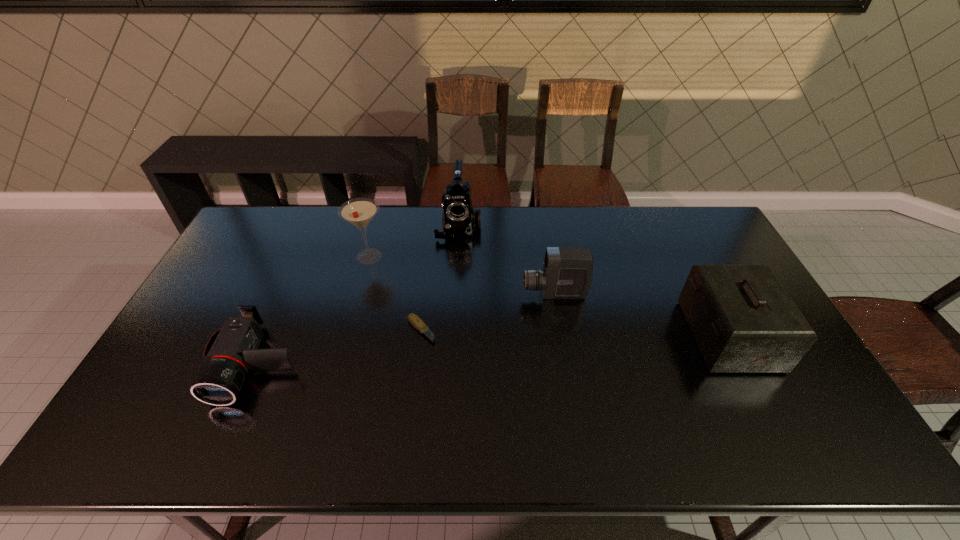
This screenshot has height=540, width=960. Find the location of `free space between the second farthest object and the fifth tallest object`. free space between the second farthest object and the fifth tallest object is located at coordinates (313, 309).

Where is `empty space that is in between the pocketknife and the nearest camcorder`? The image size is (960, 540). empty space that is in between the pocketknife and the nearest camcorder is located at coordinates (339, 346).

You are a GUI agent. You are given a task and a screenshot of the screen. Output one action in this format:
    pyautogui.click(x=<x>, y=<y>)
    Task: Click on the vacant point located between the martini and the pocketknife
    
    Given the screenshot: What is the action you would take?
    pyautogui.click(x=395, y=293)

This screenshot has height=540, width=960. Find the location of `free spot between the second shortest camcorder and the second farthest object`. free spot between the second shortest camcorder and the second farthest object is located at coordinates (462, 275).

Locate an element on the screen. This screenshot has height=540, width=960. empty space that is in between the pocketknife and the second nearest camcorder is located at coordinates (488, 312).

The image size is (960, 540). Identify the location of object that ranks as the third closest to the pocketknife. (232, 351).

Find the location of a particular element. object that is the fifth closest to the farthest object is located at coordinates (743, 321).

Select which camcorder appears as the closest to the martini. Please provide its 2D coordinates. Your answer should be formatted as a tuple, i.e. [(x, y)], where the tuple contains the x and y coordinates of a point satisfying the conditions above.

[(459, 218)]

Where is `the second closest camcorder to the fifth object from left to right`? the second closest camcorder to the fifth object from left to right is located at coordinates (232, 351).

Identify the location of vacant space that satisfies the following two spatial constraints: 1. at the front of the second object from right to left, highlighting the lens; 2. on the right side of the rightmost object. Image resolution: width=960 pixels, height=540 pixels. (562, 336).